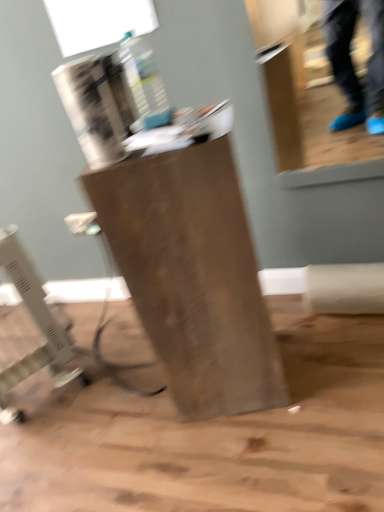
You are a GUI agent. You are given a task and a screenshot of the screen. Output one action in this format:
    pyautogui.click(x=<x>, y=<y>)
    Task: Click on the free space to the left of matte brown cabinet at center
    The height and width of the screenshot is (512, 384).
    Given the screenshot: What is the action you would take?
    pyautogui.click(x=132, y=413)